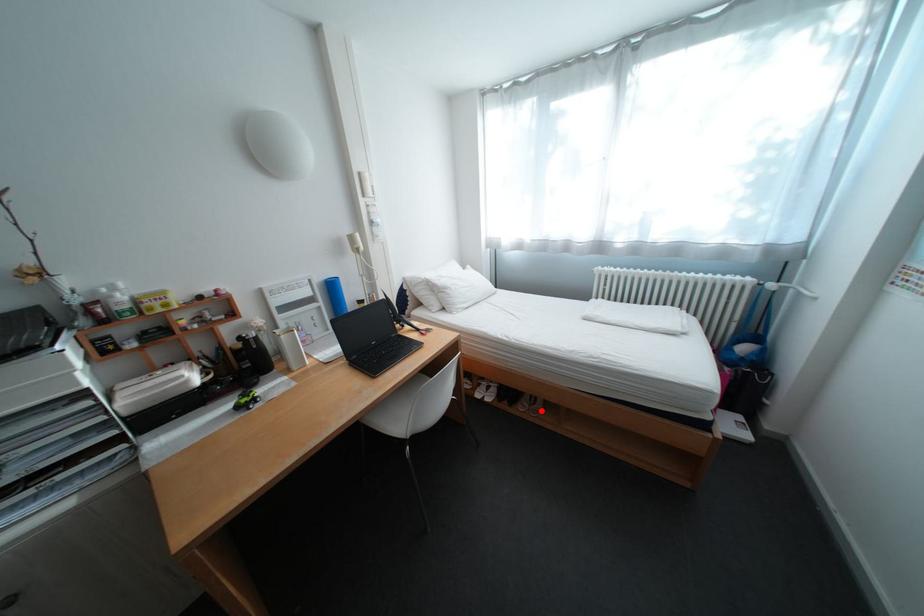
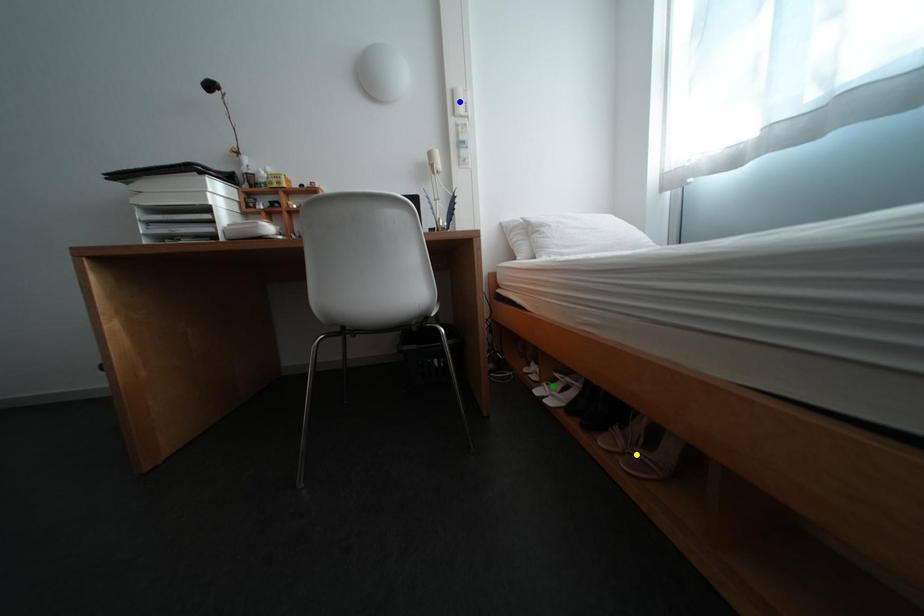
Question: I am providing you with two images of the same scene from different viewpoints. A red point is marked on the first image. You are given multiple points on the second image. Which point in image 2 represents the same 3d spot as the red point in image 1?

Choices:
 (A) yellow point
 (B) blue point
 (C) green point

Answer: (A)